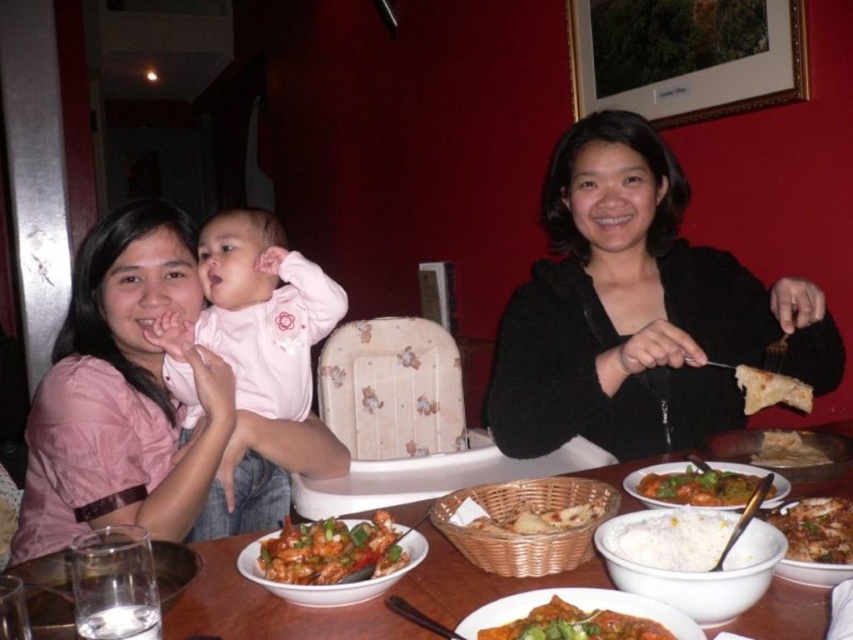
Which of these two, white ceramic bowl at center or golden brown flatbread at right, stands shorter?

Standing shorter between the two is golden brown flatbread at right.

Can you confirm if white ceramic bowl at center is smaller than golden brown flatbread at right?

Actually, white ceramic bowl at center might be larger than golden brown flatbread at right.

Is point (401, 518) in front of point (769, 465)?

Yes, it is in front of point (769, 465).

Locate an element on the screen. white ceramic bowl at center is located at coordinates (267, 609).

Is point (143, 300) farther from camera compared to point (660, 538)?

Yes, it is behind point (660, 538).

Is point (114, 241) closer to camera compared to point (659, 545)?

That is False.

Find the location of `pink fabric shirt at left`. pink fabric shirt at left is located at coordinates (120, 394).

Between shiny orange shrimp at center and tomato-based curry with vegetables at center, which one is positioned lower?

Positioned lower is tomato-based curry with vegetables at center.

Which is in front, point (276, 577) or point (567, 634)?

Point (567, 634) is in front.

What do you see at coordinates (331, 550) in the screenshot? The width and height of the screenshot is (853, 640). I see `shiny orange shrimp at center` at bounding box center [331, 550].

The height and width of the screenshot is (640, 853). What are the coordinates of `shiny orange shrimp at center` in the screenshot? It's located at (331, 550).